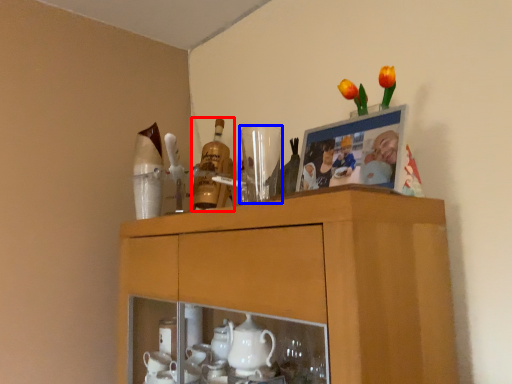
Question: Among these objects, which one is farthest to the camera, bottle (highlighted by a red box) or tableware (highlighted by a blue box)?

Choices:
 (A) bottle
 (B) tableware

Answer: (A)